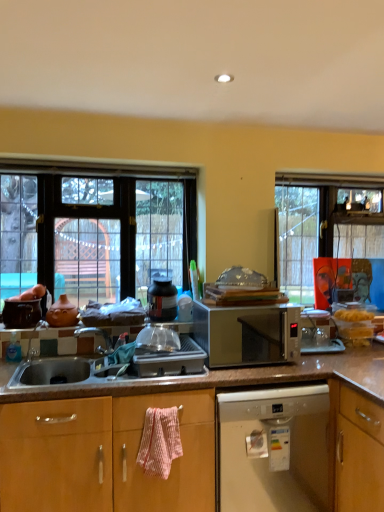
Question: From the image's perspective, would you say silver metallic microwave at center is positioned over clear glass window at left?

Choices:
 (A) no
 (B) yes

Answer: (A)

Question: Can you confirm if silver metallic microwave at center is taller than clear glass window at left?

Choices:
 (A) yes
 (B) no

Answer: (B)

Question: Can you confirm if silver metallic microwave at center is positioned to the right of clear glass window at left?

Choices:
 (A) yes
 (B) no

Answer: (A)

Question: Is silver metallic microwave at center to the left of clear glass window at left from the viewer's perspective?

Choices:
 (A) yes
 (B) no

Answer: (B)

Question: Is the position of silver metallic microwave at center less distant than that of clear glass window at left?

Choices:
 (A) no
 (B) yes

Answer: (B)

Question: In terms of height, does white plastic dishwasher at lower center look taller or shorter compared to matte black pot at center?

Choices:
 (A) short
 (B) tall

Answer: (B)

Question: Is point (231, 408) positioned closer to the camera than point (162, 287)?

Choices:
 (A) closer
 (B) farther

Answer: (A)

Question: From the image's perspective, relative to matte black pot at center, is white plastic dishwasher at lower center above or below?

Choices:
 (A) above
 (B) below

Answer: (B)

Question: Is white plastic dishwasher at lower center to the left or to the right of matte black pot at center in the image?

Choices:
 (A) left
 (B) right

Answer: (B)

Question: In terms of size, does pink textured towel at lower center appear bigger or smaller than clear glass window at left?

Choices:
 (A) small
 (B) big

Answer: (A)

Question: From a real-world perspective, is pink textured towel at lower center physically located above or below clear glass window at left?

Choices:
 (A) below
 (B) above

Answer: (A)

Question: Looking at their shapes, would you say pink textured towel at lower center is wider or thinner than clear glass window at left?

Choices:
 (A) thin
 (B) wide

Answer: (B)

Question: From the image's perspective, is pink textured towel at lower center above or below clear glass window at left?

Choices:
 (A) above
 (B) below

Answer: (B)

Question: Based on their sizes in the image, would you say clear glass window at left is bigger or smaller than white plastic dishwasher at lower center?

Choices:
 (A) small
 (B) big

Answer: (A)

Question: Would you say clear glass window at left is to the left or to the right of white plastic dishwasher at lower center in the picture?

Choices:
 (A) right
 (B) left

Answer: (B)